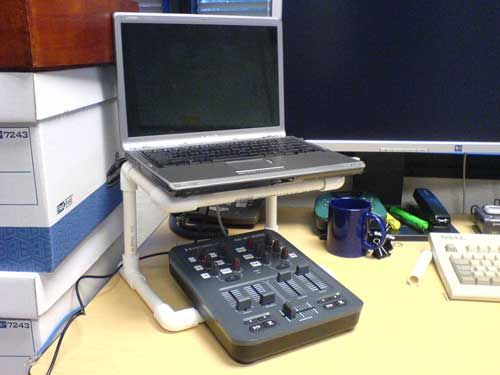
Locate an element on the screen. pvc laptop stand is located at coordinates (126, 236).